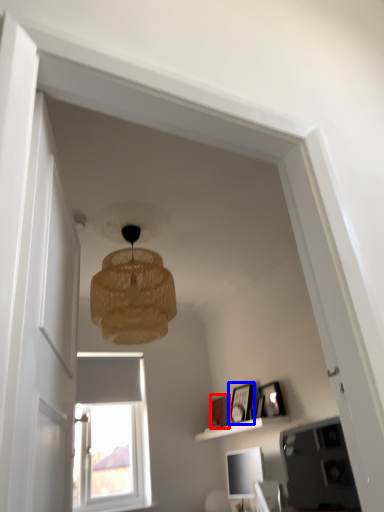
Question: Which point is further to the camera, picture frame (highlighted by a red box) or picture frame (highlighted by a blue box)?

Choices:
 (A) picture frame
 (B) picture frame

Answer: (A)